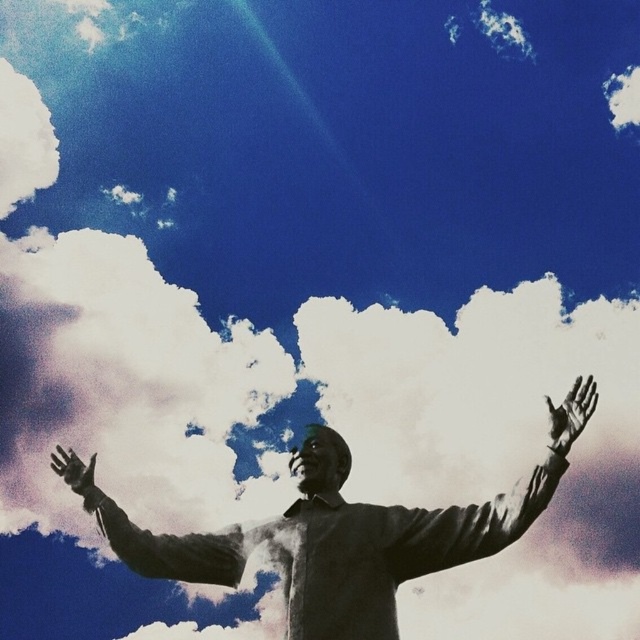
Does bronze statue at center appear on the left side of smooth skin hand at upper right?

Correct, you'll find bronze statue at center to the left of smooth skin hand at upper right.

Does bronze statue at center appear under smooth skin hand at upper right?

Yes, bronze statue at center is below smooth skin hand at upper right.

Does point (292, 589) come behind point (576, 413)?

No.

Where is `bronze statue at center`? bronze statue at center is located at coordinates (337, 544).

Who is positioned more to the right, smooth black arm at center or black matte hand at lower left?

From the viewer's perspective, smooth black arm at center appears more on the right side.

Between smooth black arm at center and black matte hand at lower left, which one appears on the left side from the viewer's perspective?

From the viewer's perspective, black matte hand at lower left appears more on the left side.

Is point (218, 577) farther from camera compared to point (81, 477)?

No, it is not.

Find the location of a particular element. smooth black arm at center is located at coordinates (154, 536).

Which is above, smooth black arm at center or smooth skin hand at upper right?

Positioned higher is smooth skin hand at upper right.

Is point (237, 531) behind point (573, 433)?

Yes, it is.

You are a GUI agent. You are given a task and a screenshot of the screen. Output one action in this format:
    pyautogui.click(x=<x>, y=<y>)
    Task: Click on the smooth black arm at center
    
    Given the screenshot: What is the action you would take?
    pyautogui.click(x=154, y=536)